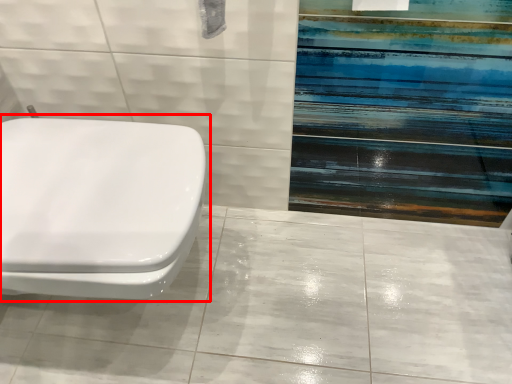
Question: From the image, what is the correct spatial relationship of toilet (annotated by the red box) in relation to ceramic tile?

Choices:
 (A) right
 (B) left

Answer: (B)